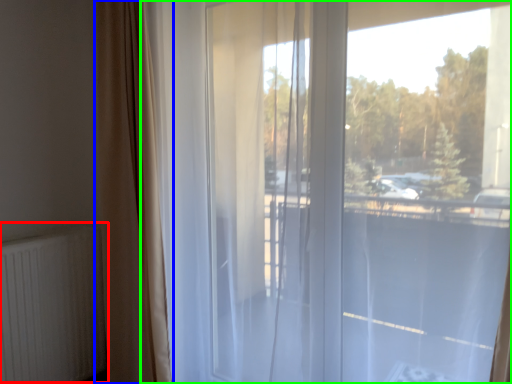
Question: Which object is the farthest from radiator (highlighted by a red box)? Choose among these: curtain (highlighted by a blue box) or window (highlighted by a green box).

Choices:
 (A) curtain
 (B) window

Answer: (B)